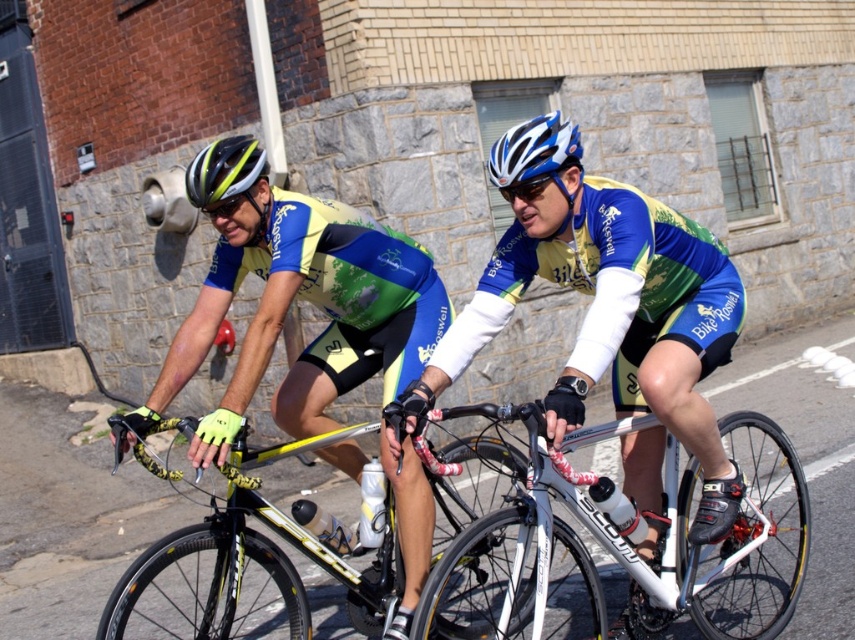
You are a photographer standing at the side of the road. You want to take a photo that includes both the matte blue cycling jersey at center and the white metallic bicycle at center. Can you fit both in your camera frame if your camera has a minimum required distance of 70 centimeters between the two objects to capture them clearly?

The matte blue cycling jersey at center and white metallic bicycle at center are 75.65 centimeters apart, which exceeds the camera frame requirement of 70 centimeters. Therefore, both objects can be captured clearly in the photo.